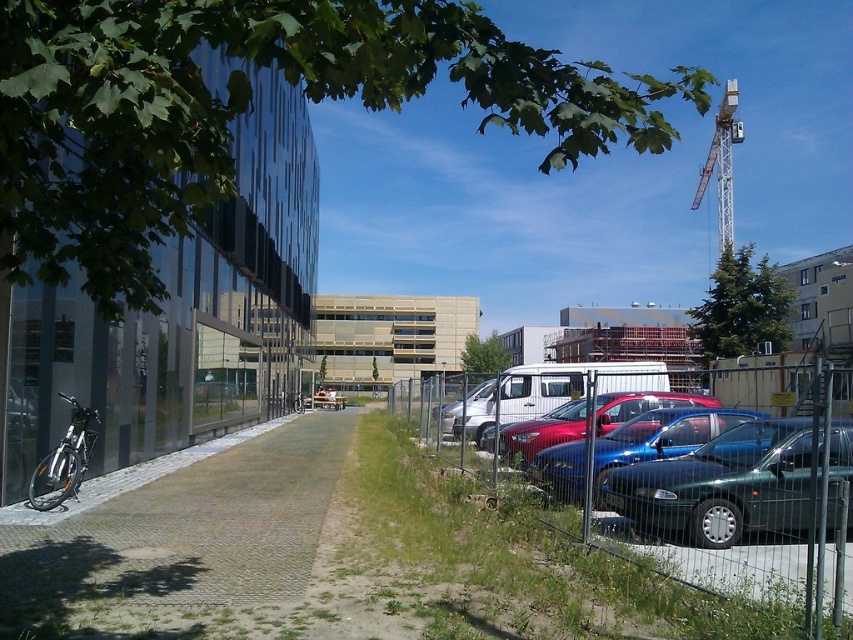
You are a delivery person trying to park your vehicle in the urban area shown. You see a metallic blue sedan at right and a shiny blue sedan at center. Which vehicle is positioned higher up in the image?

The metallic blue sedan at right is located above the shiny blue sedan at center in the image.

In the scene shown: You are a delivery person trying to deliver a package to the address located behind the metallic wire mesh fence at right. The van you are driving is the silver metallic van at center. Can you drive your van through the gap between the fence and the building next to it?

The metallic wire mesh fence at right is taller than the silver metallic van at center, so the van can pass under the fence as long as there is enough clearance. However, the exact height of the gap isn not specified, so it depends on whether the fence height allows the van to pass without hitting the fence.

You are standing at the entrance of the contemporary building with a reflective glass facade on the left side of the image. You want to walk to the shiny blue sedan at center. Which direction should you head towards?

You should head towards the center of the image to reach the shiny blue sedan at center, as its 2D location is at point (543, 432).